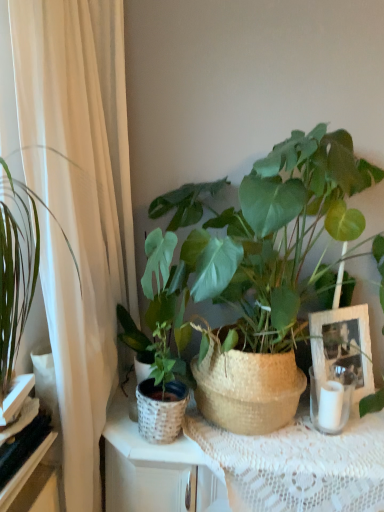
Question: From the image's perspective, does green woven basket at center, acting as the 1th houseplant starting from the left, appear higher than white wicker picture frame at center right?

Choices:
 (A) yes
 (B) no

Answer: (A)

Question: Can you confirm if green woven basket at center, acting as the 1th houseplant starting from the left, is wider than white wicker picture frame at center right?

Choices:
 (A) no
 (B) yes

Answer: (B)

Question: Considering the relative sizes of green woven basket at center, acting as the 1th houseplant starting from the left, and white wicker picture frame at center right in the image provided, is green woven basket at center, acting as the 1th houseplant starting from the left, shorter than white wicker picture frame at center right?

Choices:
 (A) yes
 (B) no

Answer: (B)

Question: Are green woven basket at center, acting as the 1th houseplant starting from the left, and white wicker picture frame at center right beside each other?

Choices:
 (A) no
 (B) yes

Answer: (A)

Question: Can you confirm if green woven basket at center, acting as the 1th houseplant starting from the left, is smaller than white wicker picture frame at center right?

Choices:
 (A) no
 (B) yes

Answer: (A)

Question: From the image's perspective, is green woven basket at center, acting as the 1th houseplant starting from the left, located beneath white wicker picture frame at center right?

Choices:
 (A) yes
 (B) no

Answer: (B)

Question: Considering the relative sizes of green woven basket at center, the second houseplant in the right-to-left sequence, and white lace tablecloth at center in the image provided, is green woven basket at center, the second houseplant in the right-to-left sequence, shorter than white lace tablecloth at center?

Choices:
 (A) no
 (B) yes

Answer: (A)

Question: Does green woven basket at center, the second houseplant in the right-to-left sequence, have a smaller size compared to white lace tablecloth at center?

Choices:
 (A) yes
 (B) no

Answer: (A)

Question: Is white lace tablecloth at center at the back of green woven basket at center, the second houseplant in the right-to-left sequence?

Choices:
 (A) no
 (B) yes

Answer: (A)

Question: Can you confirm if green woven basket at center, acting as the 1th houseplant starting from the left, is positioned to the right of white lace tablecloth at center?

Choices:
 (A) no
 (B) yes

Answer: (A)

Question: From a real-world perspective, is green woven basket at center, the second houseplant in the right-to-left sequence, positioned under white lace tablecloth at center based on gravity?

Choices:
 (A) no
 (B) yes

Answer: (A)

Question: Does green woven basket at center, acting as the 1th houseplant starting from the left, lie behind white lace tablecloth at center?

Choices:
 (A) no
 (B) yes

Answer: (B)

Question: Can you confirm if white sheer curtain at left is positioned to the left of black glossy shelf at lower left, which is the 1th shelf from bottom to top?

Choices:
 (A) yes
 (B) no

Answer: (B)